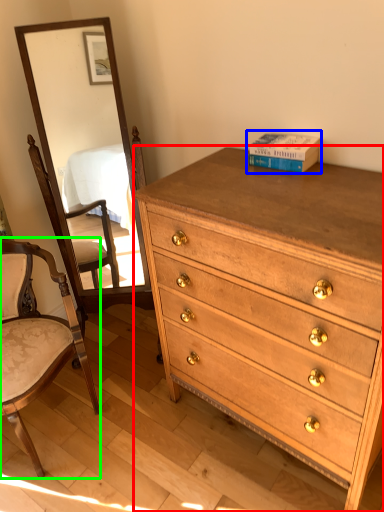
Question: Which object is positioned farthest from chest of drawers (highlighted by a red box)? Select from book (highlighted by a blue box) and chair (highlighted by a green box).

Choices:
 (A) book
 (B) chair

Answer: (B)